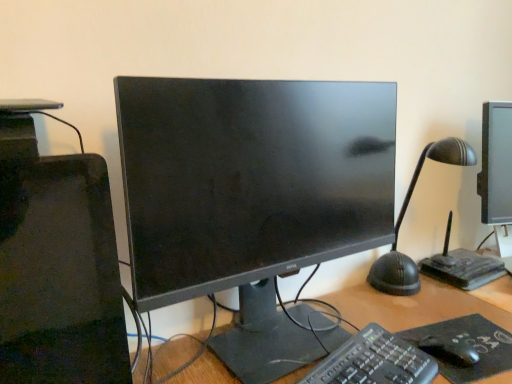
This screenshot has width=512, height=384. What are the coordinates of `empty space that is ontop of black matte mousepad at lower right (from a real-world perspective)` in the screenshot? It's located at (452, 334).